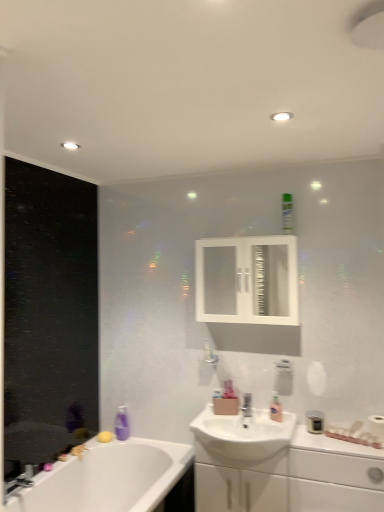
Question: Is white glossy medicine cabinet at upper center bigger than matte black canister at lower right, the 1th toiletry positioned from the bottom?

Choices:
 (A) yes
 (B) no

Answer: (A)

Question: Can matte black canister at lower right, marked as the 3th toiletry in a top-to-bottom arrangement, be found inside white glossy medicine cabinet at upper center?

Choices:
 (A) yes
 (B) no

Answer: (B)

Question: Is white glossy medicine cabinet at upper center thinner than matte black canister at lower right, which is the 1th toiletry from right to left?

Choices:
 (A) no
 (B) yes

Answer: (A)

Question: Considering the relative positions of white glossy medicine cabinet at upper center and matte black canister at lower right, which is the 1th toiletry from right to left, in the image provided, is white glossy medicine cabinet at upper center to the right of matte black canister at lower right, which is the 1th toiletry from right to left, from the viewer's perspective?

Choices:
 (A) no
 (B) yes

Answer: (A)

Question: Does white glossy medicine cabinet at upper center turn towards matte black canister at lower right, placed as the third toiletry when sorted from left to right?

Choices:
 (A) no
 (B) yes

Answer: (A)

Question: Considering the positions of pink glossy lotion at sink, marked as the third toiletry in a right-to-left arrangement, and white glossy bathtub at lower left in the image, is pink glossy lotion at sink, marked as the third toiletry in a right-to-left arrangement, taller or shorter than white glossy bathtub at lower left?

Choices:
 (A) tall
 (B) short

Answer: (B)

Question: Do you think pink glossy lotion at sink, positioned as the first toiletry in left-to-right order, is within white glossy bathtub at lower left, or outside of it?

Choices:
 (A) outside
 (B) inside

Answer: (A)

Question: In the image, is pink glossy lotion at sink, marked as the third toiletry in a right-to-left arrangement, positioned in front of or behind white glossy bathtub at lower left?

Choices:
 (A) behind
 (B) front

Answer: (A)

Question: Based on their sizes in the image, would you say pink glossy lotion at sink, positioned as the first toiletry in left-to-right order, is bigger or smaller than white glossy bathtub at lower left?

Choices:
 (A) big
 (B) small

Answer: (B)

Question: Would you say satin nickel faucet at sink center, the 2th tap in the left-to-right sequence, is inside or outside chrome metallic faucet at lower left, acting as the second tap starting from the back?

Choices:
 (A) outside
 (B) inside

Answer: (A)

Question: Relative to chrome metallic faucet at lower left, the second tap viewed from the right, is satin nickel faucet at sink center, which is counted as the 1th tap, starting from the back, in front or behind?

Choices:
 (A) behind
 (B) front

Answer: (A)

Question: From the image's perspective, is satin nickel faucet at sink center, marked as the first tap in a right-to-left arrangement, located above or below chrome metallic faucet at lower left, which ranks as the 1th tap in bottom-to-top order?

Choices:
 (A) above
 (B) below

Answer: (A)

Question: From a real-world perspective, relative to chrome metallic faucet at lower left, the first tap from the front, is satin nickel faucet at sink center, which is counted as the 1th tap, starting from the back, vertically above or below?

Choices:
 (A) below
 (B) above

Answer: (B)

Question: Visually, is white glossy medicine cabinet at upper center positioned to the left or to the right of white glossy cabinet at lower right?

Choices:
 (A) left
 (B) right

Answer: (A)

Question: From the image's perspective, is white glossy medicine cabinet at upper center located above or below white glossy cabinet at lower right?

Choices:
 (A) above
 (B) below

Answer: (A)